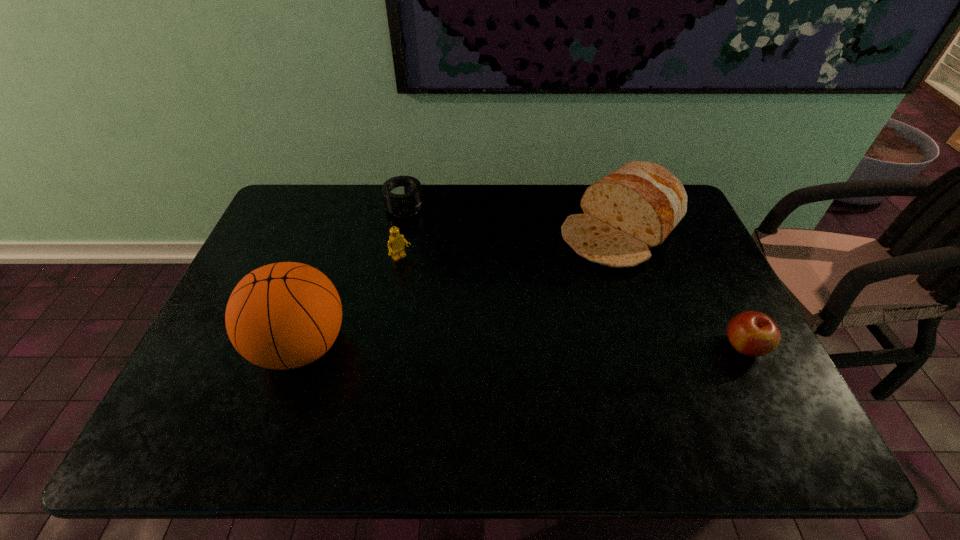
What are the coordinates of `empty space that is in between the Lego and the apple` in the screenshot? It's located at (572, 302).

Locate an element on the screen. This screenshot has width=960, height=540. vacant space that is in between the fourth shortest object and the basketball is located at coordinates (461, 288).

At what (x,y) coordinates should I click in order to perform the action: click on unoccupied position between the bread and the Lego. Please return your answer as a coordinate pair (x, y). The image size is (960, 540). Looking at the image, I should click on click(511, 244).

This screenshot has height=540, width=960. Find the location of `vacant space that's between the Lego and the telephoto lens`. vacant space that's between the Lego and the telephoto lens is located at coordinates (403, 233).

I want to click on vacant area that lies between the Lego and the bread, so click(511, 244).

Where is `vacant area between the apple and the telephoto lens`? This screenshot has height=540, width=960. vacant area between the apple and the telephoto lens is located at coordinates (574, 277).

At what (x,y) coordinates should I click in order to perform the action: click on free space between the Lego and the apple. Please return your answer as a coordinate pair (x, y). This screenshot has height=540, width=960. Looking at the image, I should click on (572, 302).

Locate an element on the screen. vacant area that lies between the shortest object and the Lego is located at coordinates (403, 233).

Identify the location of empty space between the second tallest object and the apple. (682, 288).

Identify which object is the fourth closest to the apple. Please provide its 2D coordinates. Your answer should be formatted as a tuple, i.e. [(x, y)], where the tuple contains the x and y coordinates of a point satisfying the conditions above.

[(285, 315)]